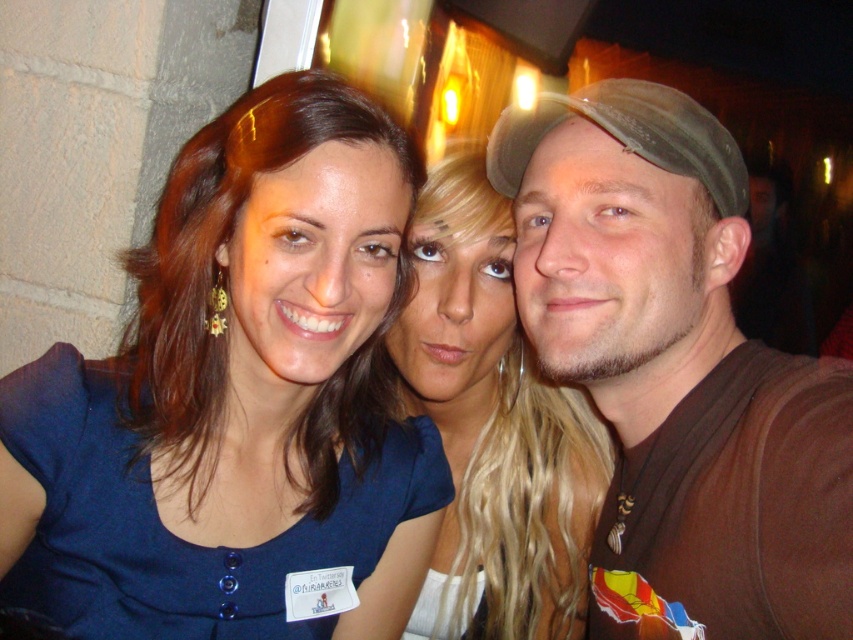
Between blonde hair at center and green fabric baseball cap at right, which one appears on the right side from the viewer's perspective?

Positioned to the right is green fabric baseball cap at right.

Image resolution: width=853 pixels, height=640 pixels. What do you see at coordinates (492, 428) in the screenshot?
I see `blonde hair at center` at bounding box center [492, 428].

Is point (599, 456) closer to viewer compared to point (689, 113)?

No, it is behind (689, 113).

The image size is (853, 640). In order to click on blonde hair at center in this screenshot , I will do `click(492, 428)`.

Based on the photo, is brown fabric shirt at center below blonde hair at center?

Actually, brown fabric shirt at center is above blonde hair at center.

Between brown fabric shirt at center and blonde hair at center, which one has more height?

Standing taller between the two is blonde hair at center.

Who is more forward, (718,566) or (416,618)?

Point (718,566)

The width and height of the screenshot is (853, 640). I want to click on brown fabric shirt at center, so click(677, 369).

Consider the image. Does blue fabric dress at upper left have a larger size compared to blonde hair at center?

Yes, blue fabric dress at upper left is bigger than blonde hair at center.

Between point (177, 262) and point (447, 593), which one is positioned behind?

The point (447, 593) is more distant.

Between point (149, 362) and point (430, 228), which one is positioned in front?

Point (149, 362)

At what (x,y) coordinates should I click in order to perform the action: click on blue fabric dress at upper left. Please return your answer as a coordinate pair (x, y). The width and height of the screenshot is (853, 640). Looking at the image, I should click on (236, 401).